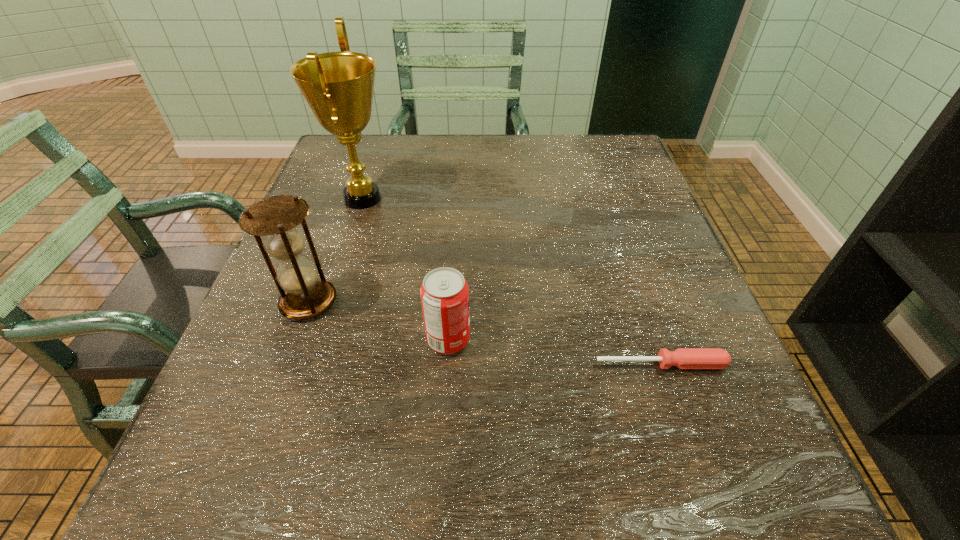
I want to click on vacant area in the image that satisfies the following two spatial constraints: 1. on the front side of the hourglass; 2. on the left side of the soda can, so click(x=295, y=340).